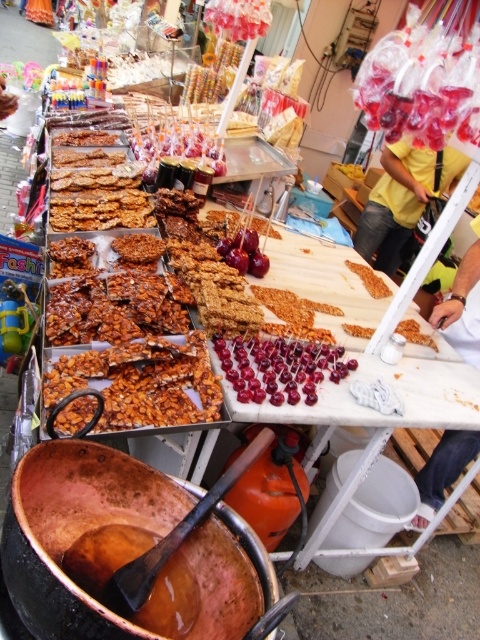
Between point (64, 388) and point (355, 268), which one is positioned behind?

The point (355, 268) is behind.

Does crispy golden nuts at center appear over crispy brown granola bar at center?

Actually, crispy golden nuts at center is below crispy brown granola bar at center.

Who is more forward, [63,390] or [346,264]?

Point [63,390] is in front.

This screenshot has width=480, height=640. I want to click on crispy golden nuts at center, so click(143, 385).

Is crunchy almond bar at center bigger than crispy brown granola bar at center?

Indeed, crunchy almond bar at center has a larger size compared to crispy brown granola bar at center.

Can you confirm if crunchy almond bar at center is wider than crispy brown granola bar at center?

Yes.

Image resolution: width=480 pixels, height=640 pixels. What do you see at coordinates (415, 333) in the screenshot?
I see `crunchy almond bar at center` at bounding box center [415, 333].

The width and height of the screenshot is (480, 640). Identify the location of crunchy almond bar at center. (415, 333).

Does yellow cotton shirt at upper right have a lesser height compared to shiny red cherries at center?

No.

Consider the image. Can you confirm if yellow cotton shirt at upper right is bigger than shiny red cherries at center?

Correct, yellow cotton shirt at upper right is larger in size than shiny red cherries at center.

Measure the distance between point (440, 184) and camera.

Point (440, 184) is 3.83 meters from camera.

Locate an element on the screen. The image size is (480, 640). yellow cotton shirt at upper right is located at coordinates (403, 198).